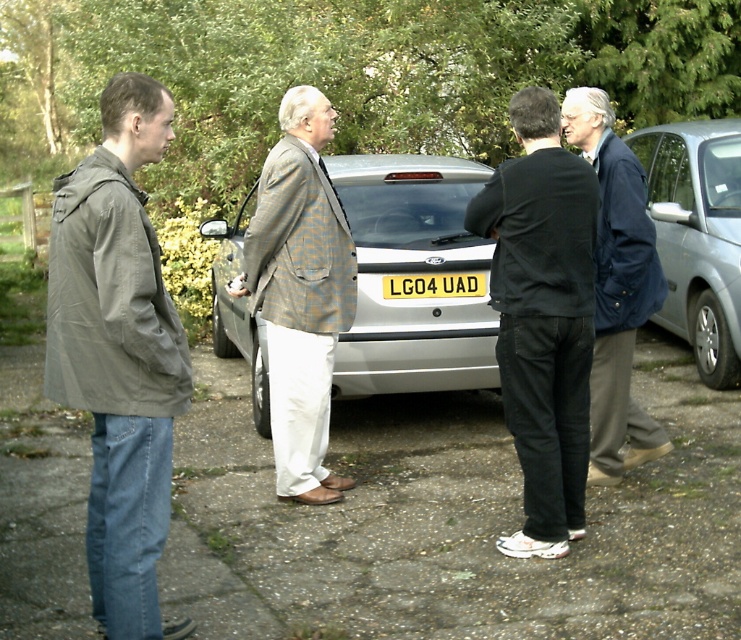
Question: Which of the following is the farthest from the observer?

Choices:
 (A) (391, 356)
 (B) (578, 177)
 (C) (144, 413)

Answer: (A)

Question: Does silver metallic car at right appear under blue corduroy jacket at center?

Choices:
 (A) no
 (B) yes

Answer: (A)

Question: Among these points, which one is farthest from the camera?

Choices:
 (A) (711, 332)
 (B) (166, 452)
 (C) (588, 301)
 (D) (579, 131)

Answer: (A)

Question: Which point is closer to the camera taking this photo?

Choices:
 (A) (637, 205)
 (B) (545, 209)

Answer: (B)

Question: Does silver metallic car at center appear on the left side of yellow matte license plate at center?

Choices:
 (A) no
 (B) yes

Answer: (B)

Question: Is silver metallic car at center wider than yellow matte license plate at center?

Choices:
 (A) yes
 (B) no

Answer: (A)